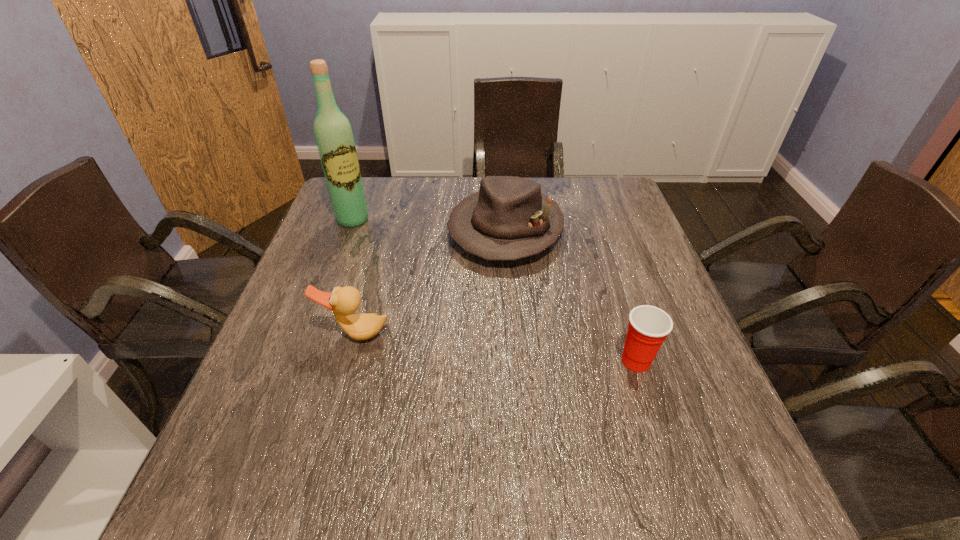
What are the coordinates of `blank area at the near edge` in the screenshot? It's located at (x=367, y=440).

This screenshot has width=960, height=540. In order to click on vacant space at the left edge in this screenshot , I will do `click(289, 386)`.

Identify the location of vacant space at the right edge. The width and height of the screenshot is (960, 540). (657, 282).

In the image, there is a desktop. Where is `vacant area at the far right corner`? The image size is (960, 540). vacant area at the far right corner is located at coordinates (601, 186).

This screenshot has height=540, width=960. Identify the location of vacant area at the near right corner. point(670,420).

Where is `empty space that is in between the nearest object and the duck`? empty space that is in between the nearest object and the duck is located at coordinates (495, 347).

The image size is (960, 540). Identify the location of vacant area that lies between the duck and the third object from left to right. (431, 281).

Where is `free point between the third object from left to right and the tallest object`? The height and width of the screenshot is (540, 960). free point between the third object from left to right and the tallest object is located at coordinates (429, 225).

Locate an element on the screen. This screenshot has width=960, height=540. free space between the second object from right to left and the wine bottle is located at coordinates (429, 225).

Where is `vacant space that's between the second nearest object and the rightmost object`? The image size is (960, 540). vacant space that's between the second nearest object and the rightmost object is located at coordinates (495, 347).